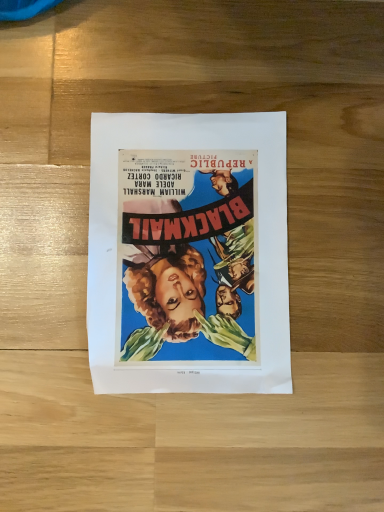
This screenshot has height=512, width=384. I want to click on vacant area on top of vibrant paper poster at center (from a real-world perspective), so click(186, 248).